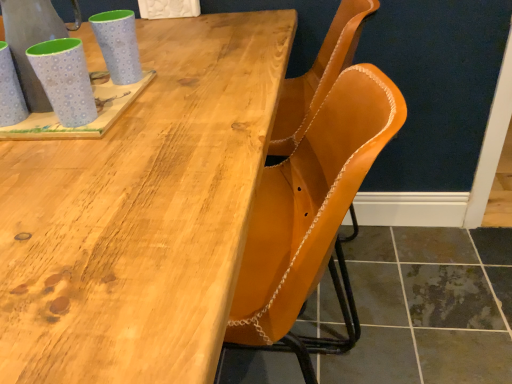
Question: From their relative heights in the image, would you say leather at center is taller or shorter than matte blue mug at upper left, marked as the second mug in a left-to-right arrangement?

Choices:
 (A) short
 (B) tall

Answer: (B)

Question: Is leather at center inside or outside of matte blue mug at upper left, marked as the second mug in a left-to-right arrangement?

Choices:
 (A) inside
 (B) outside

Answer: (B)

Question: Considering the real-world distances, which object is closest to the natural wood table at upper center?

Choices:
 (A) leather at center
 (B) matte blue mug at left, acting as the 1th mug starting from the left
 (C) brushed metal pitcher at upper left
 (D) matte blue mug at upper left, the 2th mug positioned from the right
 (E) matte blue mug at upper left, which ranks as the 1th mug in right-to-left order

Answer: (D)

Question: Considering the real-world distances, which object is farthest from the matte blue mug at left, acting as the third mug starting from the right?

Choices:
 (A) natural wood table at upper center
 (B) leather at center
 (C) matte blue mug at upper left, which is the 3th mug in left-to-right order
 (D) brushed metal pitcher at upper left
 (E) matte blue mug at upper left, the 2th mug positioned from the right

Answer: (B)